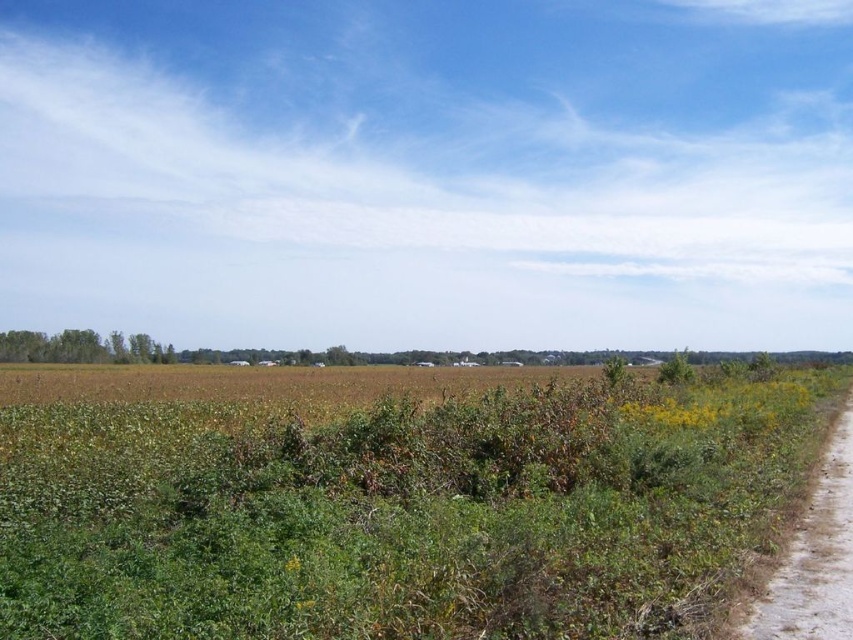
Question: Does green leafy grass at center appear under dirt track at right?

Choices:
 (A) yes
 (B) no

Answer: (B)

Question: Does green leafy grass at center appear under dirt track at right?

Choices:
 (A) yes
 (B) no

Answer: (B)

Question: Where is green leafy grass at center located in relation to dirt track at right in the image?

Choices:
 (A) above
 (B) below

Answer: (A)

Question: Among these objects, which one is farthest from the camera?

Choices:
 (A) dirt track at right
 (B) green leafy grass at center

Answer: (A)